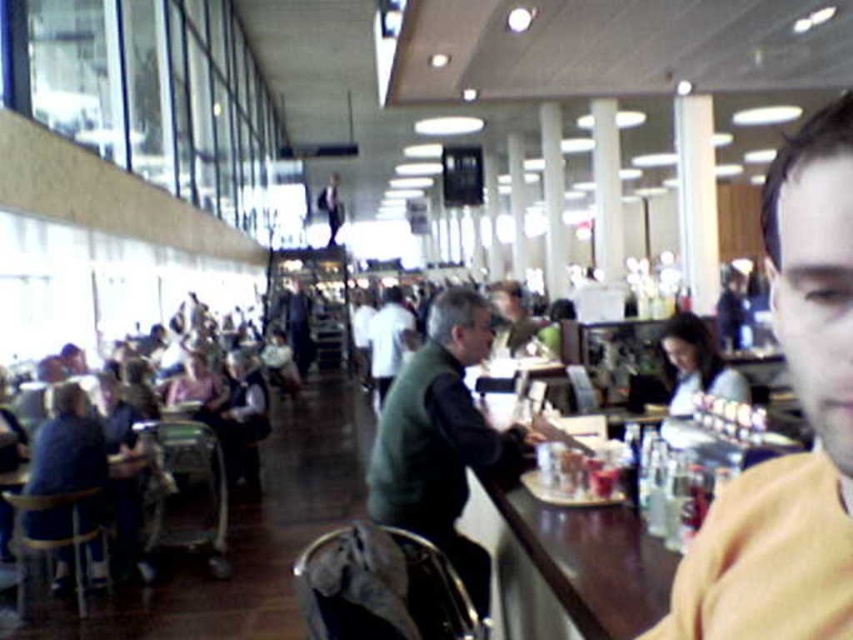
You are standing in the food court and want to find the man in the yellow fabric shirt at right. According to the image, where should you look relative to the center of the scene?

The yellow fabric shirt at right is located at 2D coordinates point 0.650 on the x axis and 0.944 on the y axis, which is to the right and slightly above the center of the scene.

You are a photographer trying to capture the scene from the front. The wooden table at center and the white shirt at center are in your view. Which object is closer to the camera?

The wooden table at center is positioned under the white shirt at center, so the white shirt at center is closer to the camera.